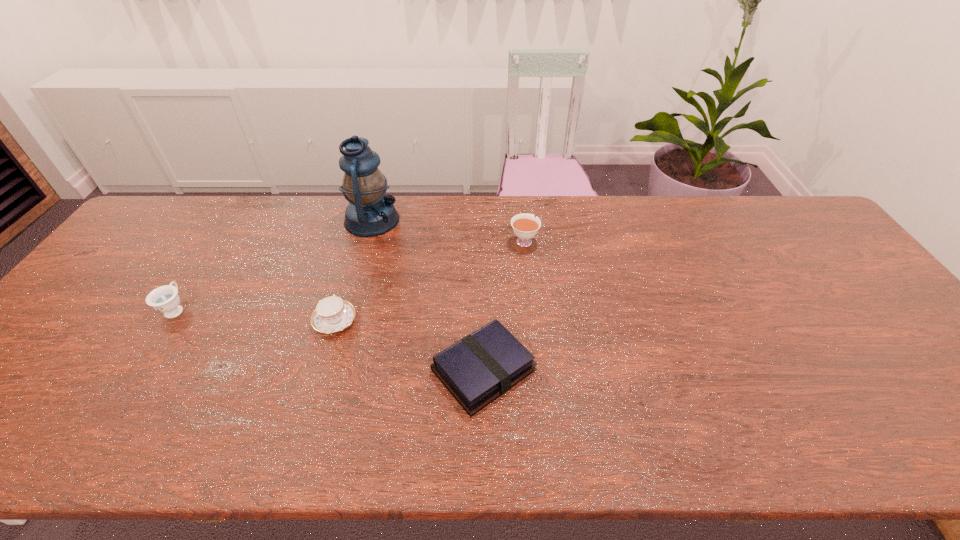
The height and width of the screenshot is (540, 960). Find the location of `the tallest object`. the tallest object is located at coordinates (370, 212).

You are a GUI agent. You are given a task and a screenshot of the screen. Output one action in this format:
    pyautogui.click(x=<x>, y=<y>)
    Task: Click on the rightmost teacup
    This screenshot has height=540, width=960.
    Given the screenshot: What is the action you would take?
    pyautogui.click(x=525, y=226)

The image size is (960, 540). What are the coordinates of `the leftmost teacup` in the screenshot? It's located at (165, 299).

You are a GUI agent. You are given a task and a screenshot of the screen. Output one action in this format:
    pyautogui.click(x=<x>, y=<y>)
    Task: Click on the second teacup from left to right
    This screenshot has height=540, width=960.
    Given the screenshot: What is the action you would take?
    pyautogui.click(x=332, y=314)

In order to click on book in this screenshot , I will do [x=484, y=365].

Where is `free region located on the face of the tallest object`? free region located on the face of the tallest object is located at coordinates (433, 220).

This screenshot has height=540, width=960. What are the coordinates of `vacant space positioned on the side of the rightmost teacup with the handle` in the screenshot? It's located at (521, 217).

I want to click on vacant area situated on the side of the rightmost teacup with the handle, so click(519, 201).

Find the location of a particular element. Image resolution: width=960 pixels, height=540 pixels. vacant space located 0.110m on the side of the rightmost teacup with the handle is located at coordinates (520, 210).

What are the coordinates of `free space located 0.260m on the side of the leftmost object with the handle` in the screenshot? It's located at (224, 235).